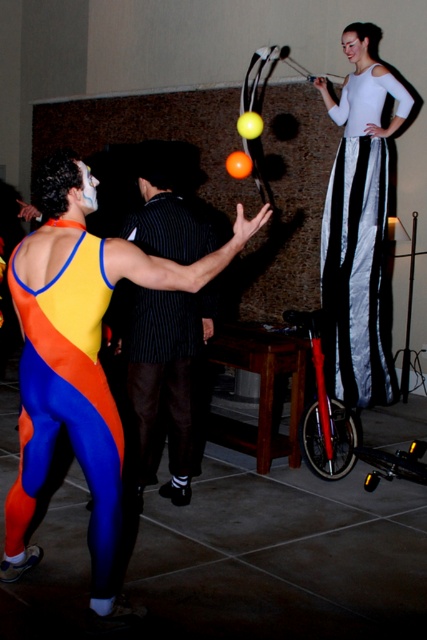
You are a photographer setting up a camera to capture the circus performers. You need to adjust the focus so that both the white satin pants at upper right and the black striped suit at center are in clear view. Which performer should you focus on first to ensure both are sharp?

The white satin pants at upper right is taller than the black striped suit at center, so you should focus on the white satin pants at upper right first to ensure both are in clear view.

Based on the coordinates provided in the scene description, where is the neon spandex suit at center located?

The neon spandex suit at center is located at point 0.630 in the x axis and 0.159 in the y axis.